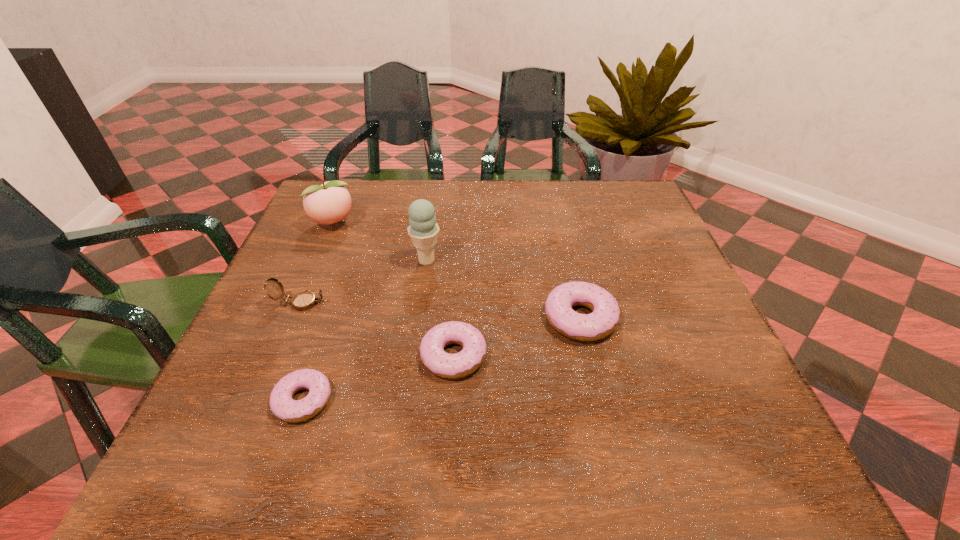
Where is `the leftmost doughnut`? the leftmost doughnut is located at coordinates coord(282,405).

I want to click on the shortest doughnut, so click(282, 405).

At what (x,y) coordinates should I click in order to perform the action: click on the second tallest doughnut. Please return your answer as a coordinate pair (x, y). The image size is (960, 540). Looking at the image, I should click on (470, 358).

Locate an element on the screen. This screenshot has height=540, width=960. the fifth tallest object is located at coordinates (470, 358).

This screenshot has width=960, height=540. In order to click on the rightmost doughnut in this screenshot , I will do `click(605, 316)`.

Where is `the tallest doughnut`? This screenshot has height=540, width=960. the tallest doughnut is located at coordinates [x=605, y=316].

What are the coordinates of `the farthest object` in the screenshot? It's located at (328, 203).

Identify the location of the second tallest object. (328, 203).

Where is `the second farthest object`? This screenshot has width=960, height=540. the second farthest object is located at coordinates (423, 230).

Image resolution: width=960 pixels, height=540 pixels. I want to click on the tallest object, so click(x=423, y=230).